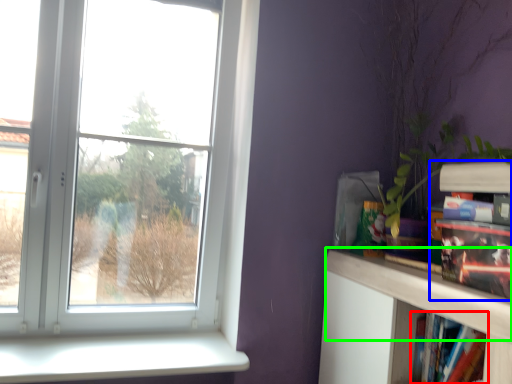
Question: Considering the real-world distances, which object is closest to book (highlighted by a red box)? book (highlighted by a blue box) or mantle (highlighted by a green box).

Choices:
 (A) book
 (B) mantle

Answer: (B)